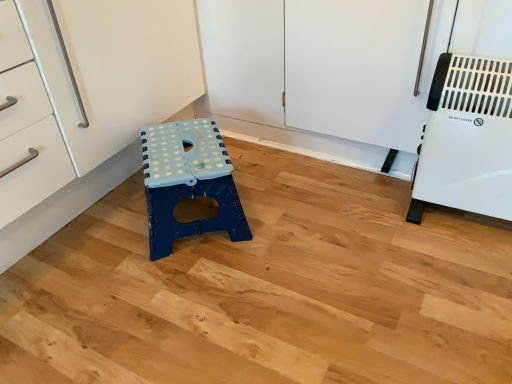
I want to click on vacant area that lies between white plastic heater at right and blue plastic stool at center, so click(325, 221).